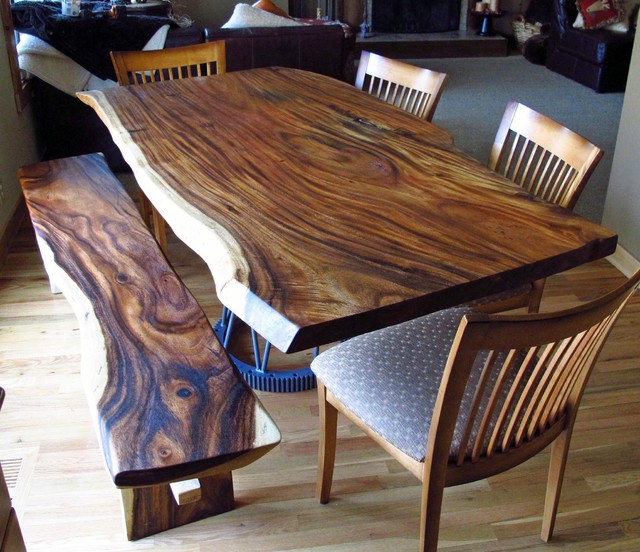
At what (x,y) coordinates should I click in order to perform the action: click on fireplace. Please return your answer as a coordinate pair (x, y). The image size is (640, 552). Looking at the image, I should click on (420, 25).